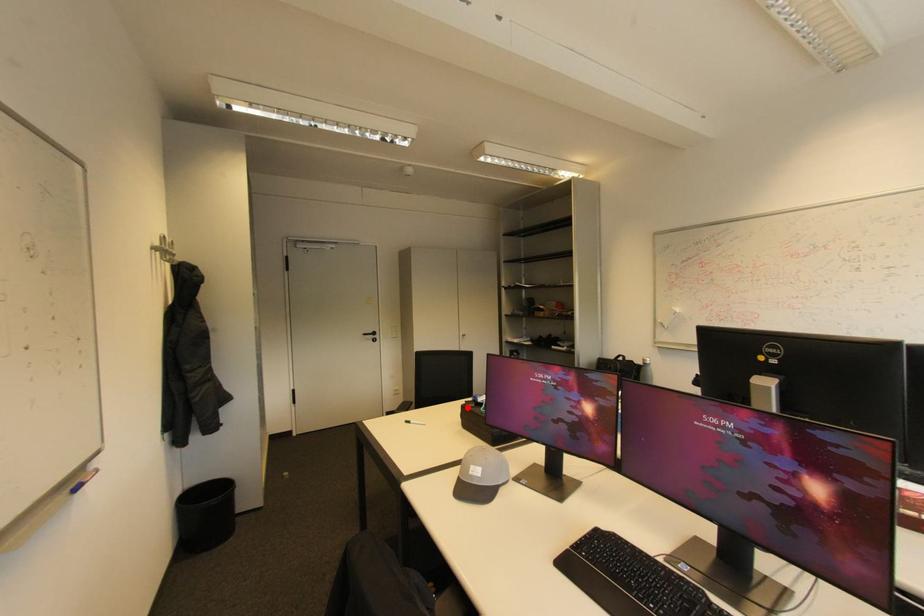
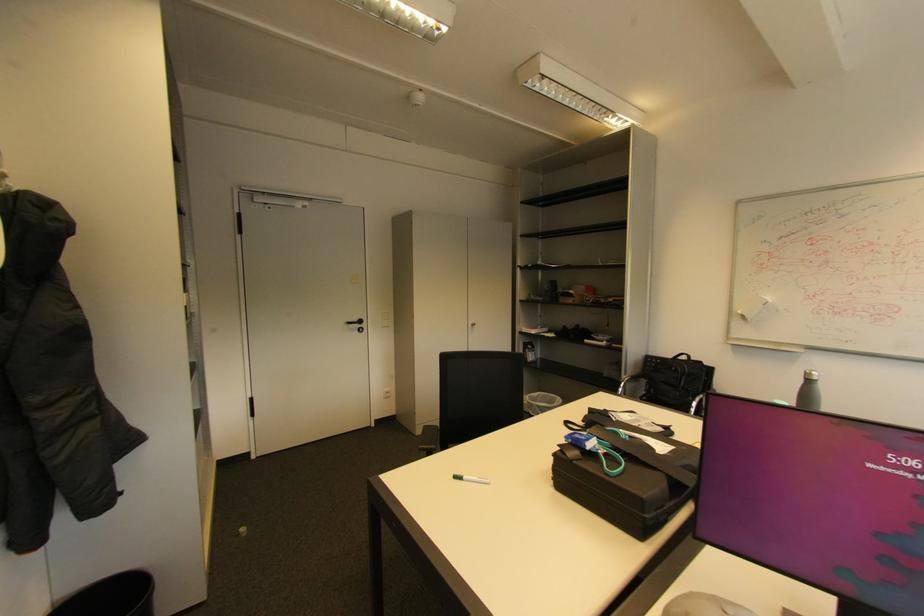
In the second image, find the point that corresponds to the highlighted location in the first image.

(561, 456)